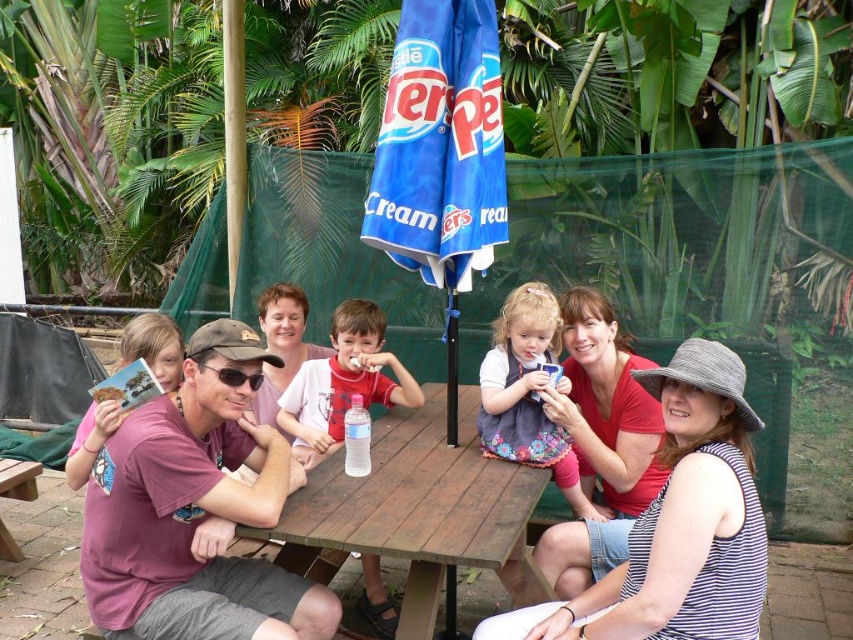
You are planning to take a photo of the group at the picnic table. The photographer wants to ensure the matte red shirt at center and the floral dress at center are both visible in the frame. Based on their positions, which one should be placed closer to the bottom of the photo to achieve this?

The matte red shirt at center is located below the floral dress at center, so to have both visible, the photographer should position the matte red shirt at center near the bottom and the floral dress at center higher up in the frame.